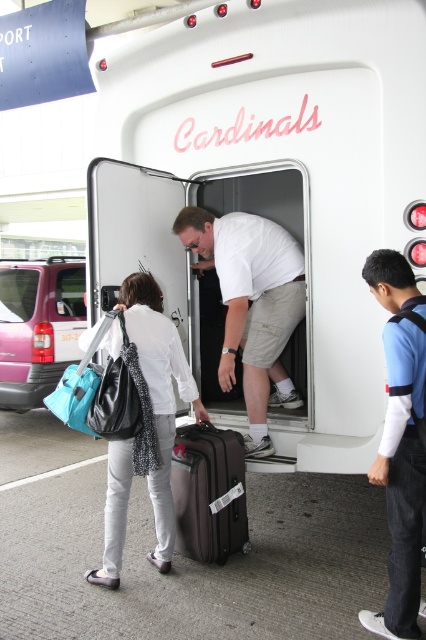
Question: Is blue fabric backpack at center right bigger than matte black bag at left?

Choices:
 (A) yes
 (B) no

Answer: (B)

Question: Among these points, which one is farthest from the camera?

Choices:
 (A) (391, 339)
 (B) (141, 298)

Answer: (B)

Question: Which object is closer to the camera taking this photo?

Choices:
 (A) matte black suitcase at center
 (B) matte black bag at left

Answer: (B)

Question: Which object is farther from the camera taking this photo?

Choices:
 (A) matte black bag at left
 (B) matte black suitcase at center

Answer: (B)

Question: Can you confirm if white matte shirt at center is smaller than matte black bag at left?

Choices:
 (A) yes
 (B) no

Answer: (B)

Question: Is matte black bag at left to the left of matte pink van at left from the viewer's perspective?

Choices:
 (A) no
 (B) yes

Answer: (A)